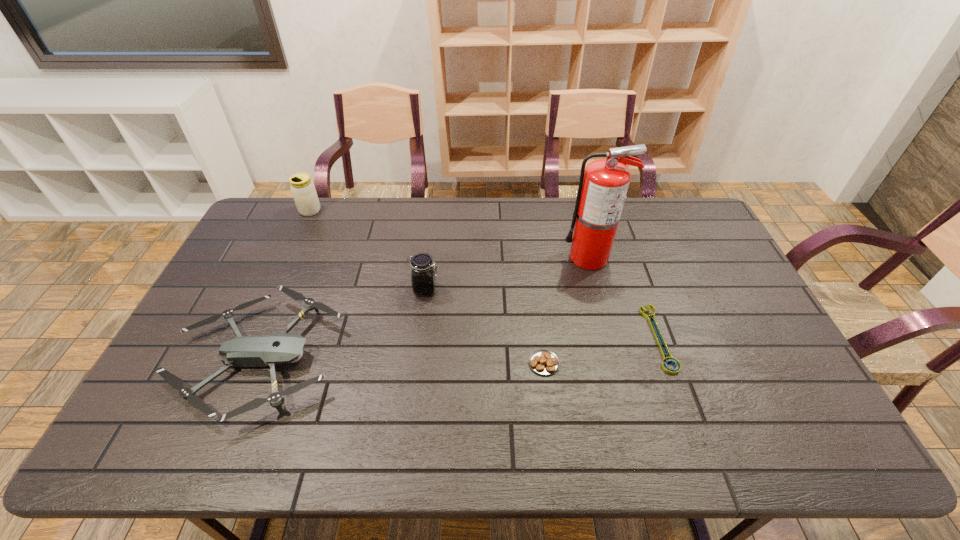
Where is `the shortest object`? the shortest object is located at coordinates (670, 359).

I want to click on blank space located 0.400m at the nozzle of the second farthest object, so click(444, 257).

Find the location of a particular element. This screenshot has height=540, width=960. vacant space located at the nozzle of the second farthest object is located at coordinates (493, 257).

Where is `blank space located at the nozzle of the second farthest object`? The width and height of the screenshot is (960, 540). blank space located at the nozzle of the second farthest object is located at coordinates (509, 257).

Locate an element on the screen. The width and height of the screenshot is (960, 540). vacant space situated on the left of the left jar is located at coordinates (286, 211).

Identify the location of free spot located on the lid of the nearer jar. The width and height of the screenshot is (960, 540). (519, 289).

The width and height of the screenshot is (960, 540). In order to click on free point located 0.270m with a camera mounted on the front of the third shortest object in this screenshot , I will do `click(439, 359)`.

Where is `free space located on the left of the pastry`? The width and height of the screenshot is (960, 540). free space located on the left of the pastry is located at coordinates (440, 363).

At what (x,y) coordinates should I click in order to perform the action: click on vacant space situated on the right of the shortest object. Please return your answer as a coordinate pair (x, y). Image resolution: width=960 pixels, height=540 pixels. Looking at the image, I should click on (718, 338).

Locate an element on the screen. This screenshot has height=540, width=960. object at the far edge is located at coordinates (303, 190).